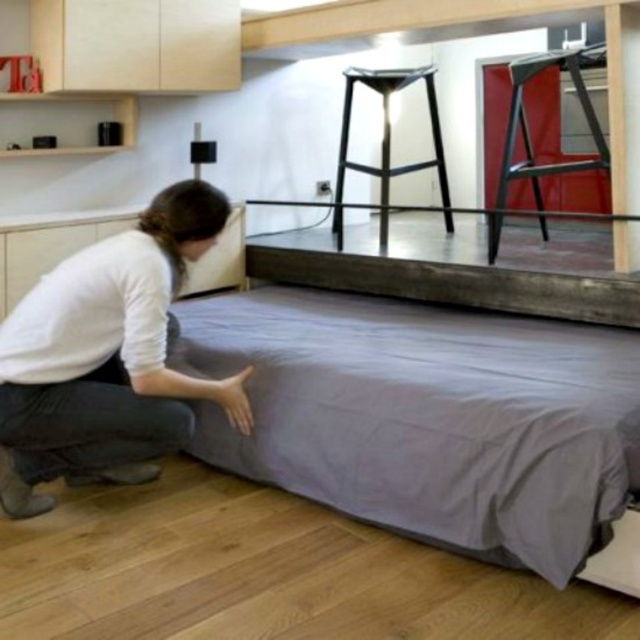
Who is positioned more to the right, gray fabric mattress at lower center or metallic stool at upper center?

From the viewer's perspective, metallic stool at upper center appears more on the right side.

Who is positioned more to the left, gray fabric mattress at lower center or metallic stool at upper center?

Positioned to the left is gray fabric mattress at lower center.

This screenshot has width=640, height=640. What are the coordinates of `gray fabric mattress at lower center` in the screenshot? It's located at (426, 417).

Who is lower down, white cotton shirt at lower left or metallic black stool at upper center?

Positioned lower is white cotton shirt at lower left.

Based on the photo, how distant is white cotton shirt at lower left from metallic black stool at upper center?

They are 6.56 feet apart.

Who is more distant from viewer, (244, 396) or (580, 80)?

The point (580, 80) is behind.

Identify the location of white cotton shirt at lower left. (106, 356).

Is the position of white cotton shirt at lower left more distant than that of metallic stool at upper center?

No, white cotton shirt at lower left is closer to the viewer.

Find the location of a particular element. white cotton shirt at lower left is located at coordinates (106, 356).

Does point (131, 465) come behind point (385, 177)?

No.

You are a GUI agent. You are given a task and a screenshot of the screen. Output one action in this format:
    pyautogui.click(x=<x>, y=<y>)
    Task: Click on the white cotton shirt at lower left
    
    Given the screenshot: What is the action you would take?
    pyautogui.click(x=106, y=356)